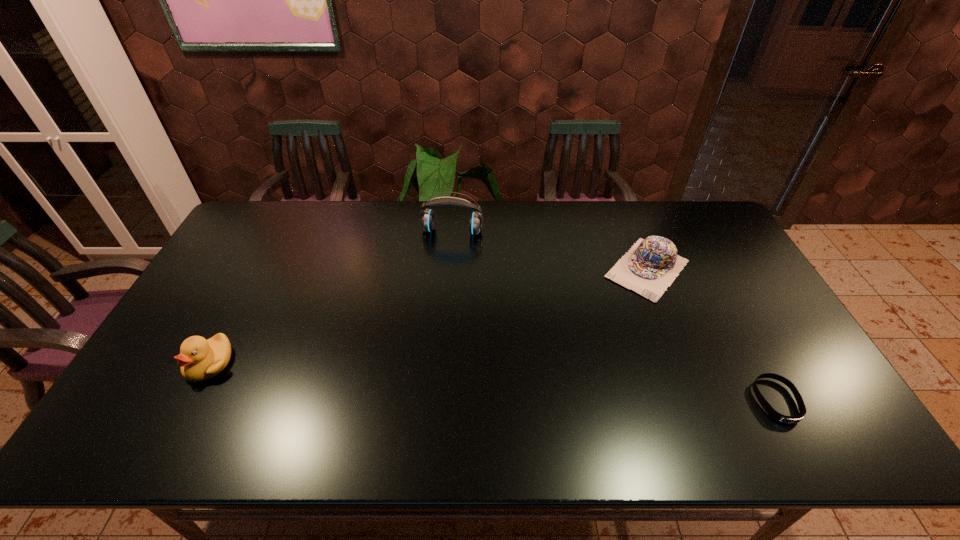
This screenshot has height=540, width=960. Identify the location of free space on the desktop that is between the duckling and the shortest object and is positioned on the ear cups of the headset. (419, 377).

The width and height of the screenshot is (960, 540). I want to click on free space on the desktop that is between the second tallest object and the shortest object and is positioned on the front, side, and top of the cap, so click(547, 386).